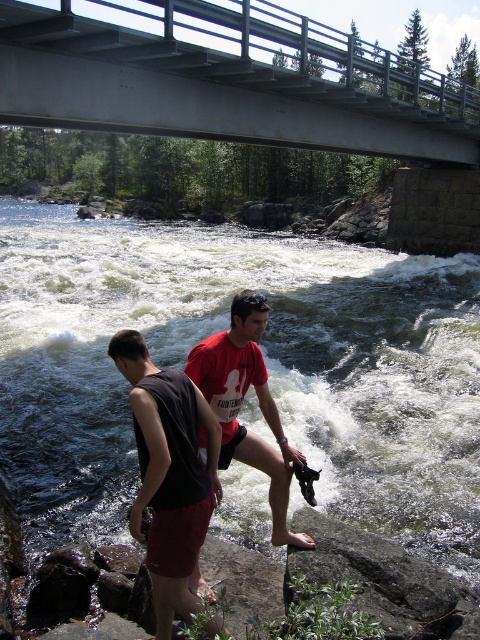
Can you confirm if metallic gray bridge at upper center is smaller than red matte t-shirt at center?

Actually, metallic gray bridge at upper center might be larger than red matte t-shirt at center.

Measure the distance between metallic gray bridge at upper center and camera.

A distance of 6.71 meters exists between metallic gray bridge at upper center and camera.

Who is more distant from viewer, (456, 97) or (256, 317)?

The point (456, 97) is behind.

I want to click on metallic gray bridge at upper center, so click(227, 77).

Does white frothy water at lower center have a lesser height compared to red matte t-shirt at center?

A: No, white frothy water at lower center is not shorter than red matte t-shirt at center.

Is the position of white frothy water at lower center less distant than that of red matte t-shirt at center?

No, it is not.

Locate an element on the screen. Image resolution: width=480 pixels, height=640 pixels. white frothy water at lower center is located at coordinates (265, 364).

Which is behind, point (266, 512) or point (249, 84)?

Point (249, 84)

Which of these two, white frothy water at lower center or metallic gray bridge at upper center, stands shorter?

Standing shorter between the two is white frothy water at lower center.

You are a GUI agent. You are given a task and a screenshot of the screen. Output one action in this format:
    pyautogui.click(x=<x>, y=<y>)
    Task: Click on the white frothy water at lower center
    
    Given the screenshot: What is the action you would take?
    pyautogui.click(x=265, y=364)

At what (x,y) coordinates should I click in order to perform the action: click on white frothy water at lower center. Please return your answer as a coordinate pair (x, y). The height and width of the screenshot is (640, 480). Looking at the image, I should click on (265, 364).